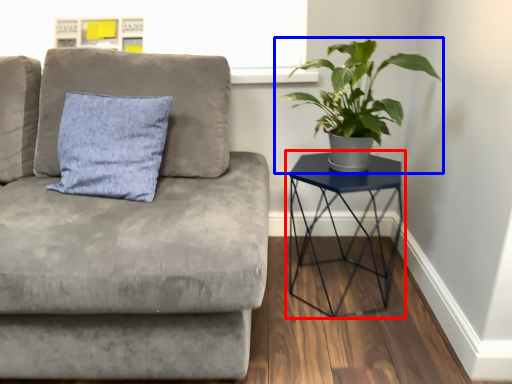
Question: Which object is closer to the camera taking this photo, table (highlighted by a red box) or houseplant (highlighted by a blue box)?

Choices:
 (A) table
 (B) houseplant

Answer: (B)